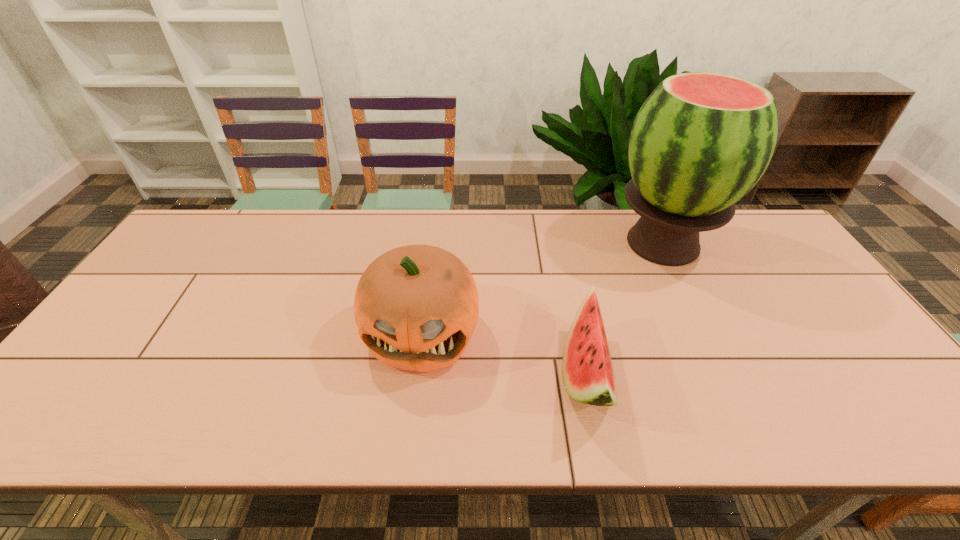
This screenshot has width=960, height=540. I want to click on vacant space located on the outer rind of the left watermelon, so click(x=475, y=373).

Image resolution: width=960 pixels, height=540 pixels. In order to click on object present at the far edge in this screenshot , I will do `click(701, 141)`.

Find the location of a particular element. object located in the near edge section of the desktop is located at coordinates (588, 377).

The width and height of the screenshot is (960, 540). I want to click on free space at the far edge of the desktop, so click(x=463, y=235).

In the image, there is a desktop. At what (x,y) coordinates should I click in order to perform the action: click on vacant space at the near edge. Please return your answer as a coordinate pair (x, y). The width and height of the screenshot is (960, 540). Looking at the image, I should click on (232, 413).

In the image, there is a desktop. What are the coordinates of `free space at the left edge` in the screenshot? It's located at (62, 397).

Where is `vacant space at the right edge of the desktop`? vacant space at the right edge of the desktop is located at coordinates (763, 266).

Identify the location of free region at the near left corner of the desktop. (59, 427).

Where is `free space at the far right corner of the desktop`? This screenshot has height=540, width=960. free space at the far right corner of the desktop is located at coordinates (753, 235).

Identify the location of blank region between the right watermelon and the shorter watermelon. The height and width of the screenshot is (540, 960). (625, 308).